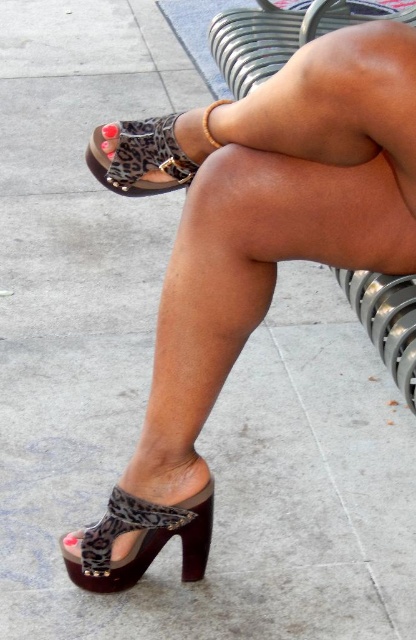
Question: Is leopard print sandal at lower center thinner than leopard print sandal at lower left?

Choices:
 (A) no
 (B) yes

Answer: (A)

Question: Can you confirm if leopard print sandal at lower center is positioned above leopard print sandal at lower left?

Choices:
 (A) no
 (B) yes

Answer: (B)

Question: Among these points, which one is farthest from the camera?

Choices:
 (A) (116, 189)
 (B) (195, 568)

Answer: (B)

Question: Observing the image, what is the correct spatial positioning of leopard print sandal at lower center in reference to leopard print sandal at lower left?

Choices:
 (A) above
 (B) below

Answer: (A)

Question: Which point is farther to the camera?

Choices:
 (A) (74, 564)
 (B) (163, 134)

Answer: (A)

Question: Estimate the real-world distances between objects in this image. Which object is farther from the leopard print sandal at lower left?

Choices:
 (A) leopard print sandal at lower center
 (B) leopard print fabric sandal at lower left

Answer: (B)